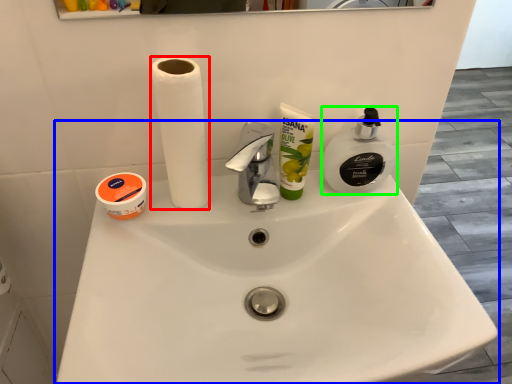
Question: Based on their relative distances, which object is nearer to paper towel (highlighted by a red box)? Choose from sink (highlighted by a blue box) and soap dispenser (highlighted by a green box).

Choices:
 (A) sink
 (B) soap dispenser

Answer: (A)